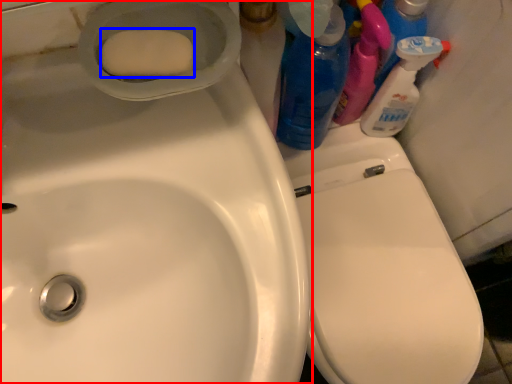
Question: Which point is closer to the camera, sink (highlighted by a red box) or soap (highlighted by a blue box)?

Choices:
 (A) sink
 (B) soap

Answer: (A)